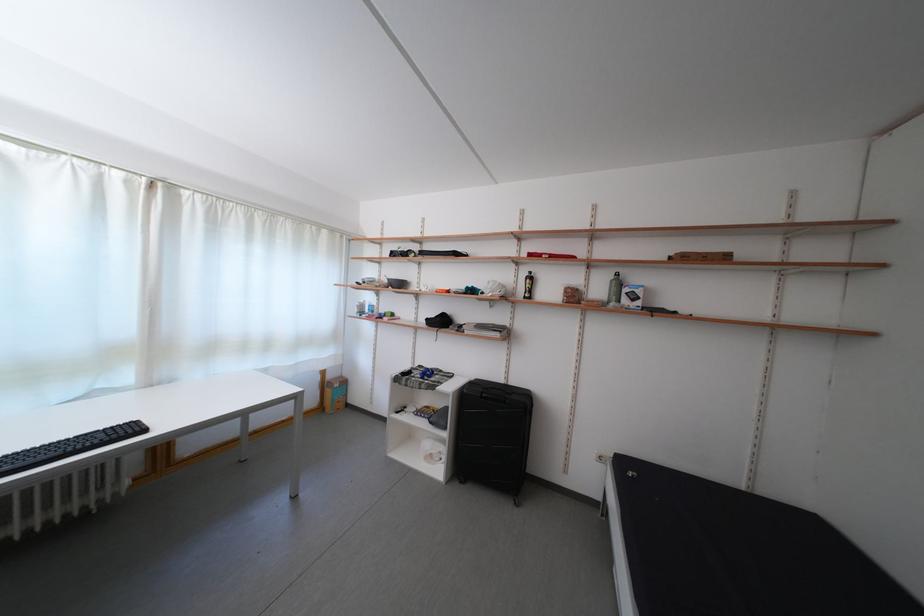
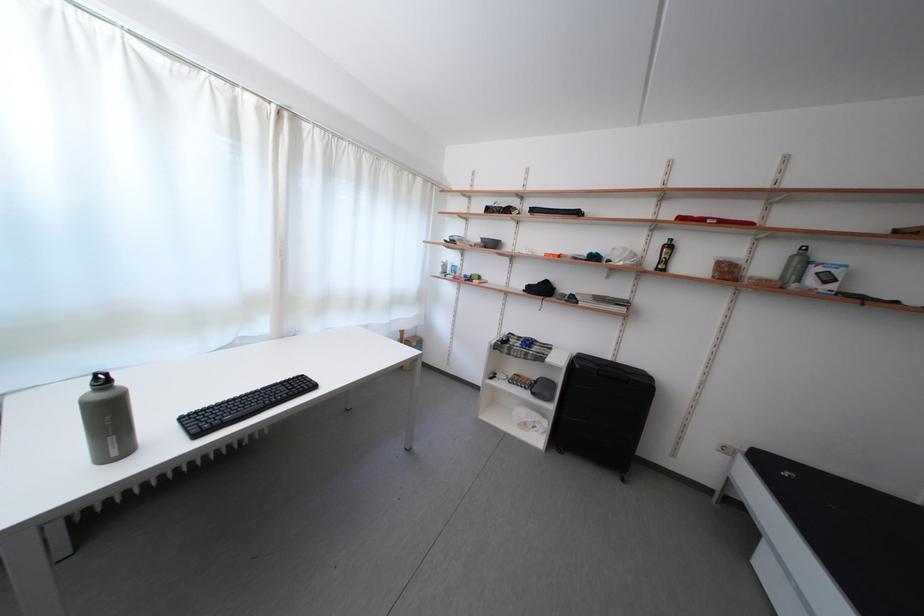
In the second image, find the point that corresponds to (511,387) in the first image.

(617, 363)